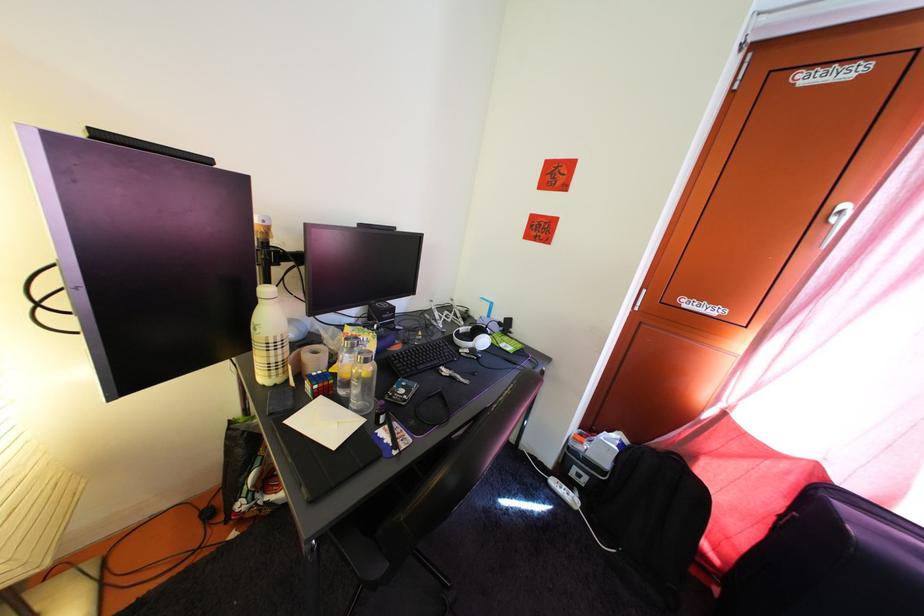
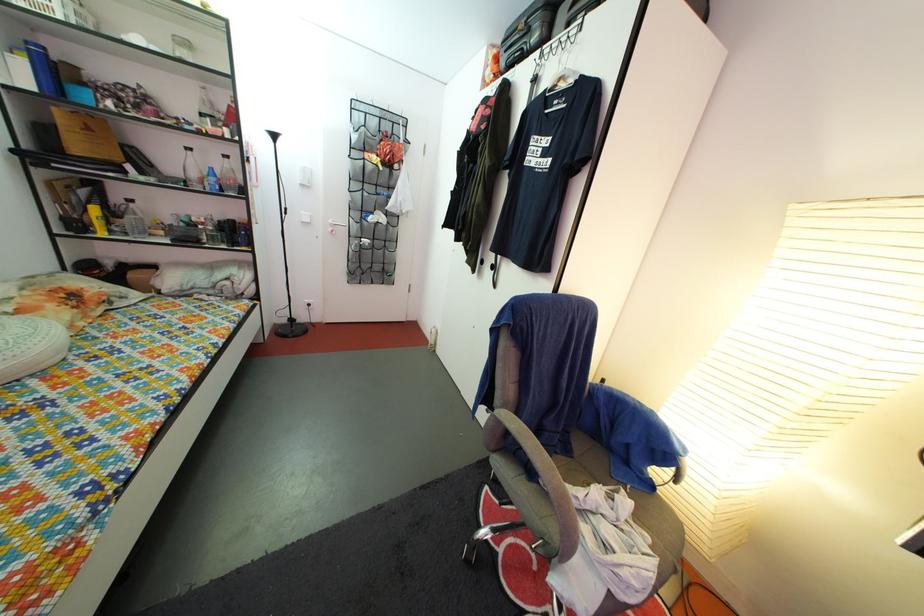
Question: The camera is either moving clockwise (left) or counter-clockwise (right) around the object. The first image is from the beginning of the video and the second image is from the end. Is the camera moving left or right when shooting the video?

Choices:
 (A) Left
 (B) Right

Answer: (B)